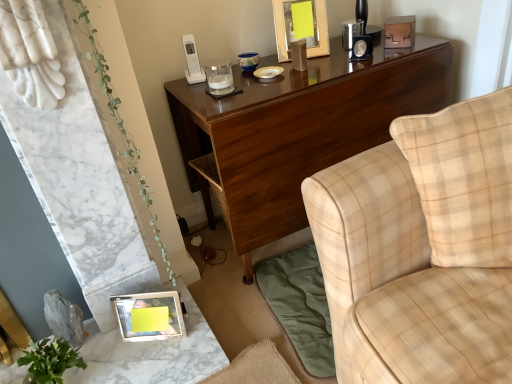
Locate an element on the screen. free space in front of yellow paper at upper center, which is the first picture frame in top-to-bottom order is located at coordinates (324, 62).